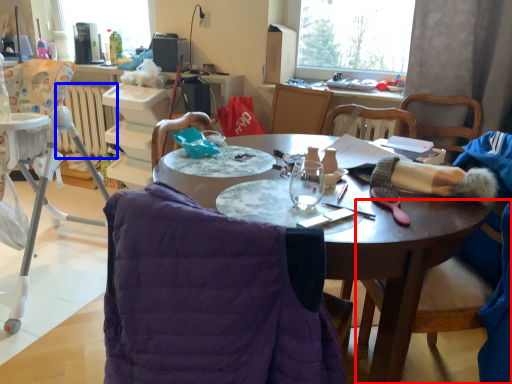
Question: Among these objects, which one is farthest to the camera, chair (highlighted by a red box) or radiator (highlighted by a blue box)?

Choices:
 (A) chair
 (B) radiator

Answer: (B)